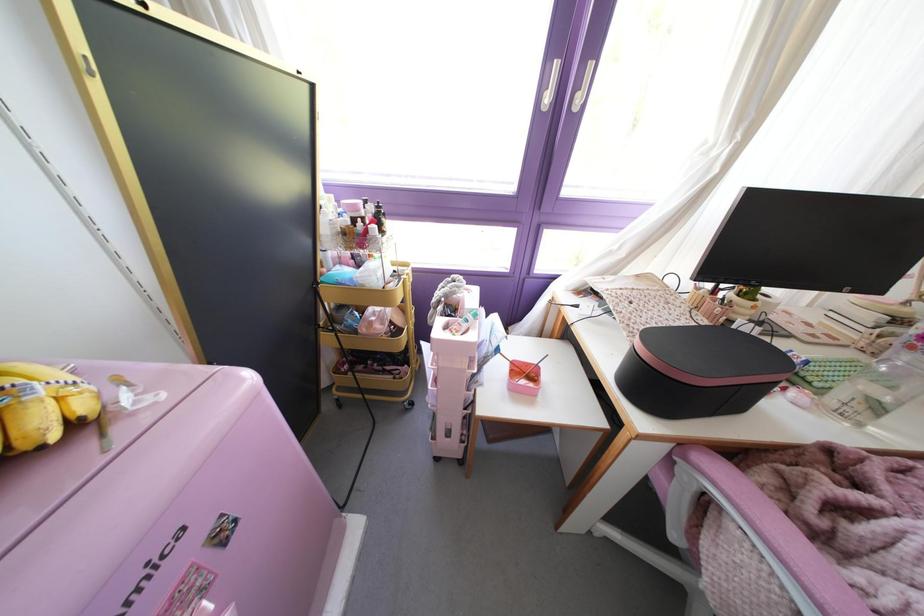
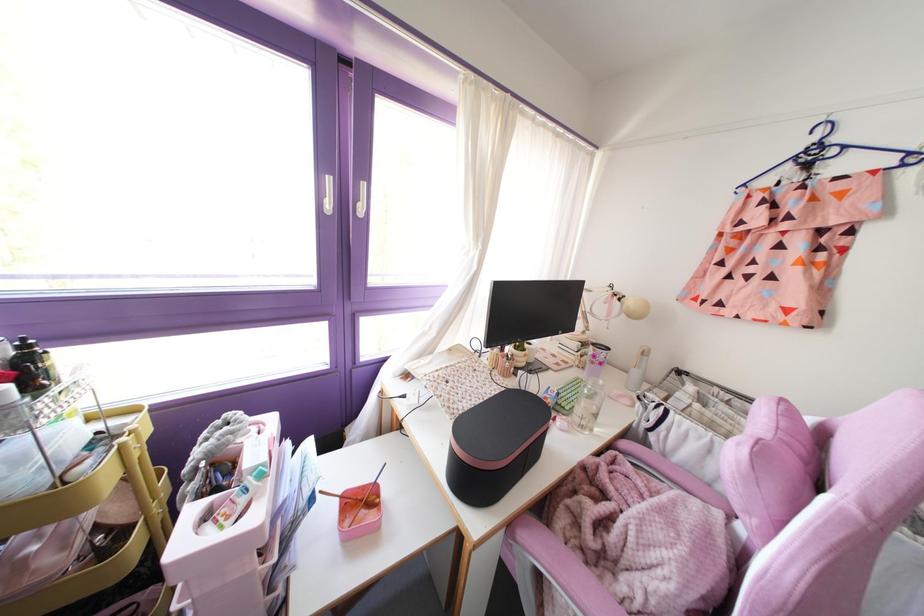
The point at (x=381, y=231) is marked in the first image. Where is the corresponding point in the second image?

(32, 389)